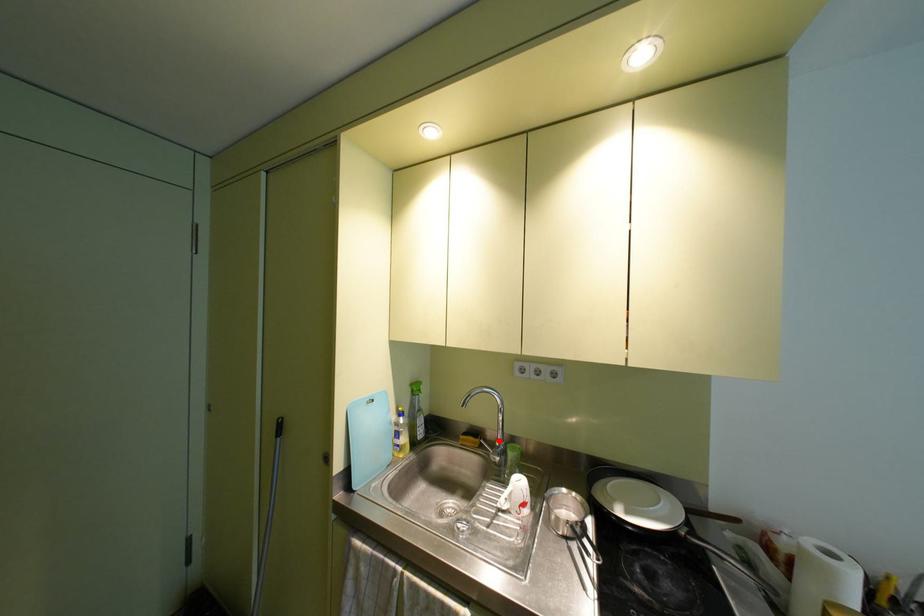
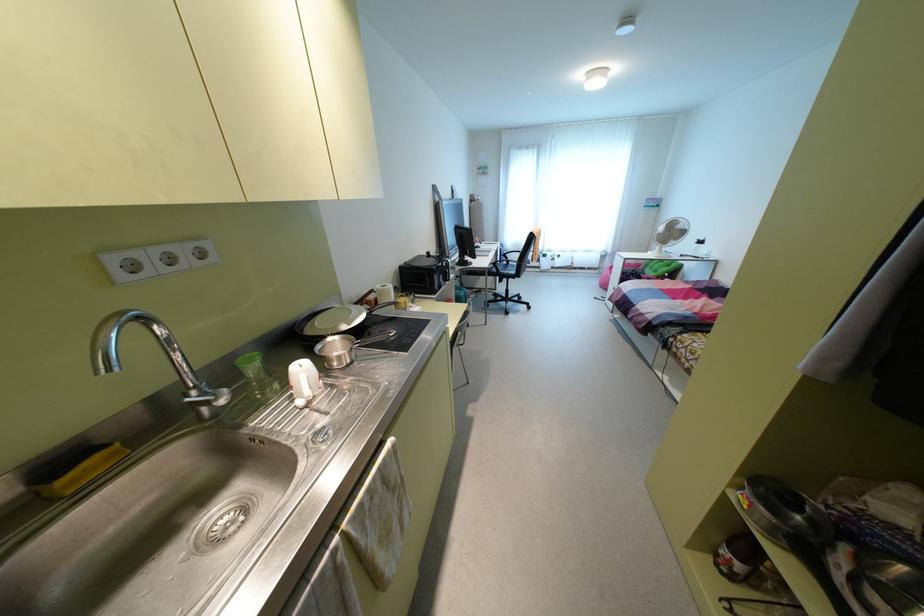
Where in the second image is the point corresponding to the highlighted location from the first image?

(195, 387)